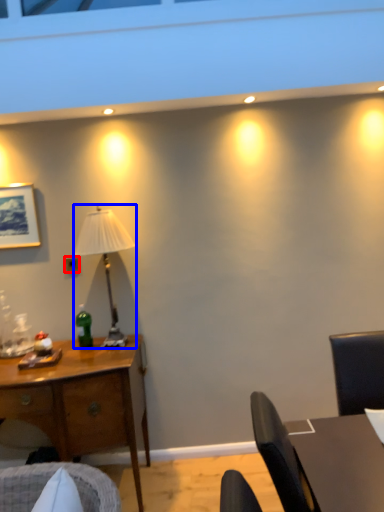
Question: Which point is further to the camera, power outlet (highlighted by a red box) or lamp (highlighted by a blue box)?

Choices:
 (A) power outlet
 (B) lamp

Answer: (A)